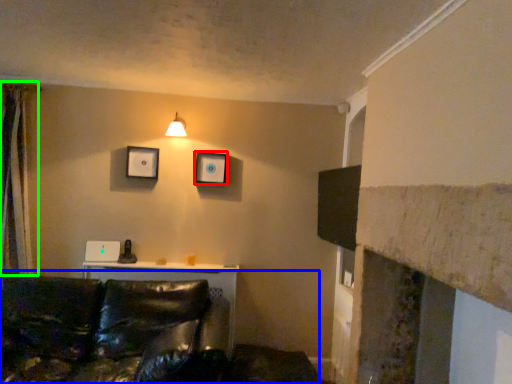
Question: Considering the real-world distances, which object is closest to picture frame (highlighted by a red box)? studio couch (highlighted by a blue box) or curtain (highlighted by a green box).

Choices:
 (A) studio couch
 (B) curtain

Answer: (A)